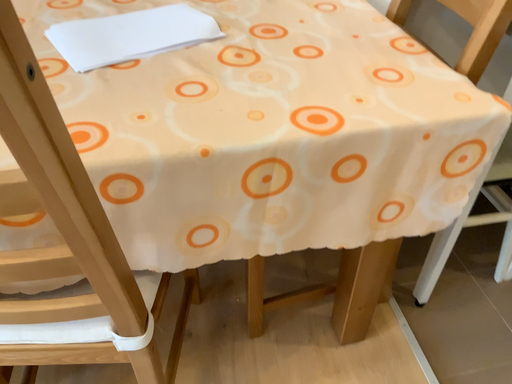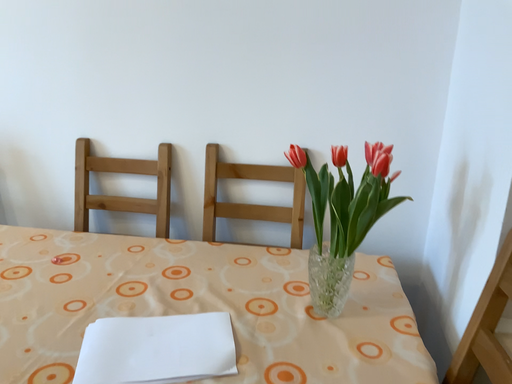
Question: How did the camera likely rotate when shooting the video?

Choices:
 (A) rotated downward
 (B) rotated upward

Answer: (B)